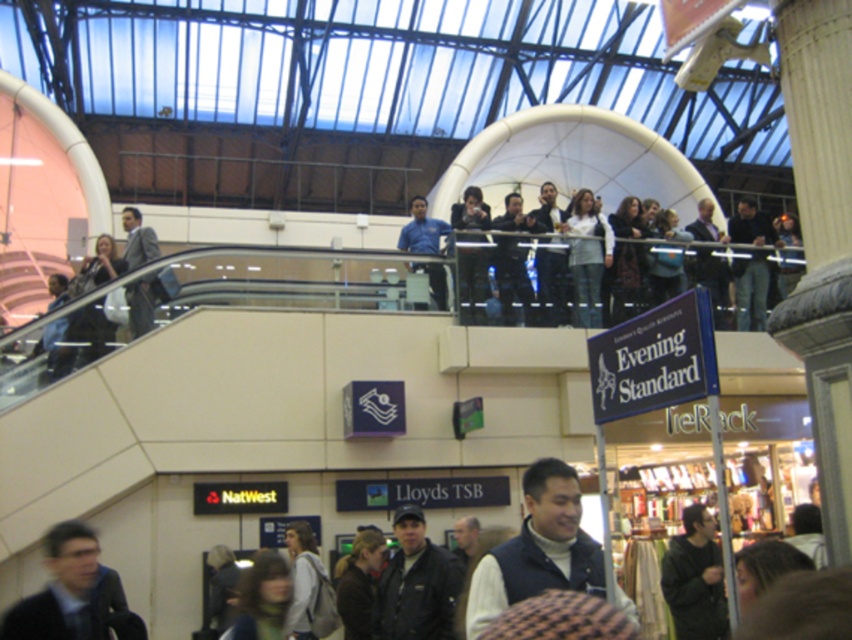
You are a fashion designer observing the scene in the mall. You notice two people wearing the dark blue vest at center and the matte gray suit at left. Which clothing item appears shorter in height?

The dark blue vest at center is not as tall as the matte gray suit at left, so the dark blue vest at center appears shorter in height.

You are an artist trying to sketch this scene. You notice the dark blue jeans at upper center and the dark gray sweater at lower right. Which object should you draw first if you want to start with the larger one?

You should draw the dark blue jeans at upper center first because it is larger in size than the dark gray sweater at lower right.